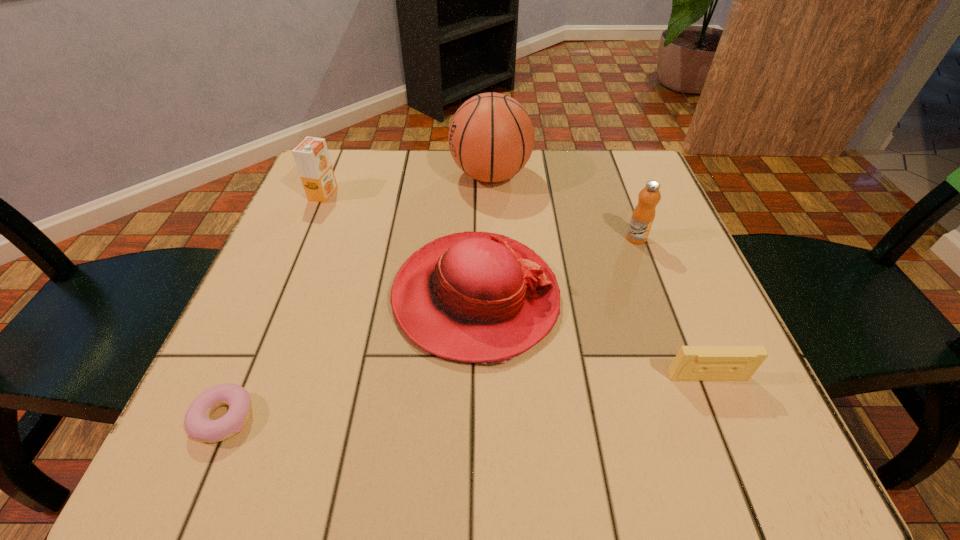
I want to click on free space at the near left corner of the desktop, so click(186, 443).

Find the location of a particular element. vacant space at the far right corner is located at coordinates (594, 199).

Where is `vacant area between the tallest object and the right orange juice`? This screenshot has width=960, height=540. vacant area between the tallest object and the right orange juice is located at coordinates (564, 207).

The height and width of the screenshot is (540, 960). In order to click on empty space that is in between the hat and the left orange juice in this screenshot , I will do `click(399, 246)`.

I want to click on free space between the nearer orange juice and the hat, so tap(556, 268).

Locate an element on the screen. empty space between the second nearest object and the right orange juice is located at coordinates (672, 308).

Locate an element on the screen. The height and width of the screenshot is (540, 960). free spot between the right orange juice and the fifth farthest object is located at coordinates (672, 308).

Locate an element on the screen. Image resolution: width=960 pixels, height=540 pixels. free space between the right orange juice and the hat is located at coordinates (556, 268).

Identify the location of free space between the doughnut and the tallest object. Image resolution: width=960 pixels, height=540 pixels. (357, 297).

You are a GUI agent. You are given a task and a screenshot of the screen. Output one action in this format:
    pyautogui.click(x=<x>, y=<y>)
    Task: Click on the empty space that is in between the right orange juice and the hat
    
    Given the screenshot: What is the action you would take?
    pyautogui.click(x=556, y=268)